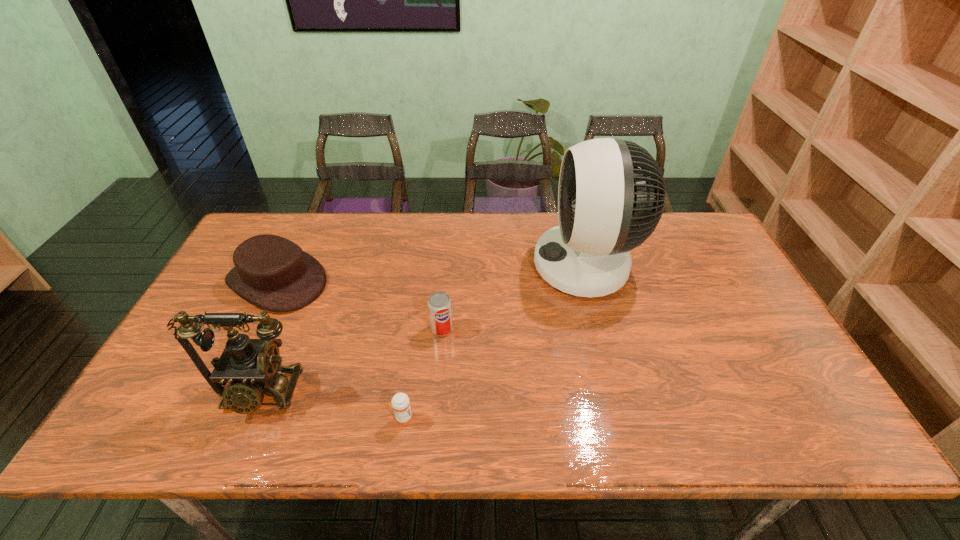
Locate an element on the screen. The image size is (960, 540). object present at the far left corner is located at coordinates (272, 272).

Image resolution: width=960 pixels, height=540 pixels. I want to click on object at the near left corner, so (252, 367).

Identify the location of vacant space at the far edge of the desktop. Image resolution: width=960 pixels, height=540 pixels. (433, 216).

In the image, there is a desktop. Where is `free space at the near edge`? This screenshot has width=960, height=540. free space at the near edge is located at coordinates (439, 416).

Find the location of `vacant point at the left edge`. vacant point at the left edge is located at coordinates (251, 309).

Locate an element on the screen. vacant position at the right edge of the desktop is located at coordinates (756, 356).

Find the location of a particular element. The width and height of the screenshot is (960, 540). free space at the far left corner of the desktop is located at coordinates (279, 225).

Find the location of a particular element. vacant region at the far right corner of the desktop is located at coordinates (660, 221).

Find the location of `empty location between the tallest object and the telephone`. empty location between the tallest object and the telephone is located at coordinates (422, 329).

Where is `free point between the hat and the fourth object from left to right`? The height and width of the screenshot is (540, 960). free point between the hat and the fourth object from left to right is located at coordinates (360, 305).